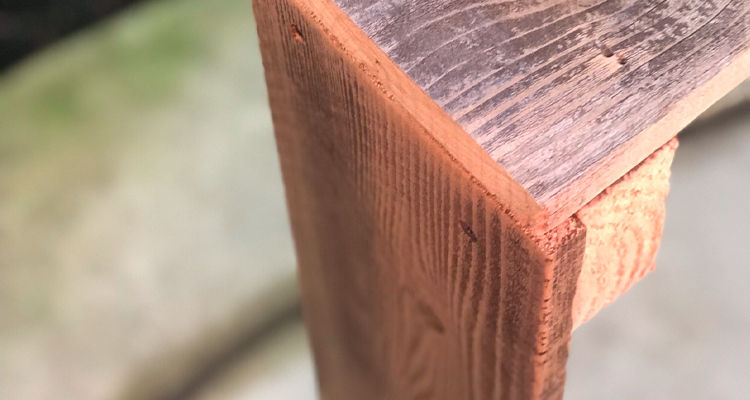
Where is `horizontal wooden beam of item`? horizontal wooden beam of item is located at coordinates (628, 45).